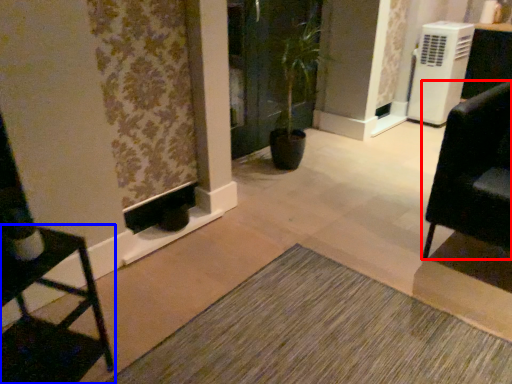
Question: Which point is further to the camera, furniture (highlighted by a red box) or furniture (highlighted by a blue box)?

Choices:
 (A) furniture
 (B) furniture

Answer: (A)